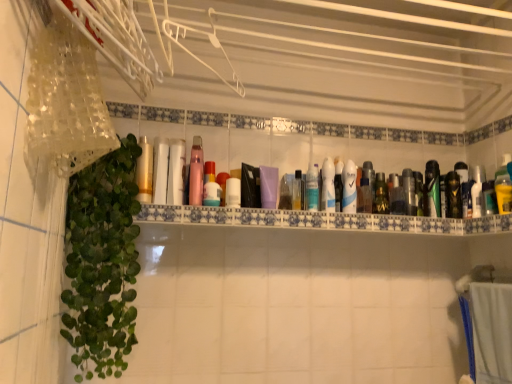
The height and width of the screenshot is (384, 512). Describe the element at coordinates (432, 189) in the screenshot. I see `green metallic mouthwash at upper right, the 16th mouthwash from the left` at that location.

I want to click on white glossy bottle at center, which is the 2th mouthwash from left to right, so tap(176, 172).

What are the coordinates of `metallic gold mouthwash at right, acting as the 17th mouthwash starting from the left` in the screenshot? It's located at (453, 195).

This screenshot has height=384, width=512. I want to click on white glossy mouthwash at center, which is the 10th mouthwash from left to right, so click(x=328, y=186).

Measure the distance between translucent plastic bottle at center, the 11th mouthwash when ordered from right to left, and camera.

The distance of translucent plastic bottle at center, the 11th mouthwash when ordered from right to left, from camera is 1.39 meters.

Measure the distance between point (x=414, y=189) and camera.

A distance of 4.95 feet exists between point (x=414, y=189) and camera.

You are a GUI agent. You are given a task and a screenshot of the screen. Output one action in this format:
    pyautogui.click(x=<x>, y=<y>)
    Task: Click on the green metallic mouthwash at upper right, the 3th mouthwash from the right
    The image size is (512, 384).
    Given the screenshot: What is the action you would take?
    pyautogui.click(x=432, y=189)

Based on the photo, is clear plastic bottle at center, the seventh mouthwash from the right, further to camera compared to white plastic hanger at upper center?

Yes.

From a real-world perspective, is clear plastic bottle at center, the seventh mouthwash from the right, positioned above or below white plastic hanger at upper center?

Clearly, from a real-world perspective, clear plastic bottle at center, the seventh mouthwash from the right, is below white plastic hanger at upper center.

Which is nearer, (x=362, y=198) or (x=234, y=75)?

The point (x=362, y=198) is more forward.

Is yellow matte bottle at right, which is the first mouthwash in right-to-left order, positioned with its back to matte pink bottle at center, the fourteenth mouthwash positioned from the right?

No, yellow matte bottle at right, which is the first mouthwash in right-to-left order,'s orientation is not away from matte pink bottle at center, the fourteenth mouthwash positioned from the right.

How much distance is there between yellow matte bottle at right, which appears as the eighteenth mouthwash when viewed from the left, and matte pink bottle at center, which is counted as the 5th mouthwash, starting from the left?

yellow matte bottle at right, which appears as the eighteenth mouthwash when viewed from the left, and matte pink bottle at center, which is counted as the 5th mouthwash, starting from the left, are 35.62 inches apart.

Which object is more forward, yellow matte bottle at right, which is the first mouthwash in right-to-left order, or matte pink bottle at center, the fourteenth mouthwash positioned from the right?

yellow matte bottle at right, which is the first mouthwash in right-to-left order.

Who is shorter, yellow matte bottle at right, which is the first mouthwash in right-to-left order, or matte pink bottle at center, the fourteenth mouthwash positioned from the right?

Standing shorter between the two is matte pink bottle at center, the fourteenth mouthwash positioned from the right.

Would you say white glossy bottle at center, which is the seventeenth mouthwash in right-to-left order, is outside metallic gold mouthwash at right, acting as the 17th mouthwash starting from the left?

white glossy bottle at center, which is the seventeenth mouthwash in right-to-left order, lies outside metallic gold mouthwash at right, acting as the 17th mouthwash starting from the left,'s area.

Between white glossy bottle at center, which is the seventeenth mouthwash in right-to-left order, and metallic gold mouthwash at right, acting as the second mouthwash starting from the right, which one appears on the left side from the viewer's perspective?

From the viewer's perspective, white glossy bottle at center, which is the seventeenth mouthwash in right-to-left order, appears more on the left side.

Is white glossy bottle at center, which is the 2th mouthwash from left to right, bigger than metallic gold mouthwash at right, acting as the second mouthwash starting from the right?

Indeed, white glossy bottle at center, which is the 2th mouthwash from left to right, has a larger size compared to metallic gold mouthwash at right, acting as the second mouthwash starting from the right.

Is white glossy bottle at center, which is the 2th mouthwash from left to right, oriented away from metallic gold mouthwash at right, acting as the second mouthwash starting from the right?

white glossy bottle at center, which is the 2th mouthwash from left to right, does not have its back to metallic gold mouthwash at right, acting as the second mouthwash starting from the right.

Between green glossy mouthwash at center right, placed as the thirteenth mouthwash when sorted from left to right, and metallic silver mouthwash at center-right, placed as the fourth mouthwash when sorted from right to left, which one appears on the right side from the viewer's perspective?

From the viewer's perspective, metallic silver mouthwash at center-right, placed as the fourth mouthwash when sorted from right to left, appears more on the right side.

Is green glossy mouthwash at center right, positioned as the 6th mouthwash in right-to-left order, positioned beyond the bounds of metallic silver mouthwash at center-right, which is counted as the 15th mouthwash, starting from the left?

That's correct, green glossy mouthwash at center right, positioned as the 6th mouthwash in right-to-left order, is outside of metallic silver mouthwash at center-right, which is counted as the 15th mouthwash, starting from the left.

From the image's perspective, is green glossy mouthwash at center right, placed as the thirteenth mouthwash when sorted from left to right, located above metallic silver mouthwash at center-right, placed as the fourth mouthwash when sorted from right to left?

Actually, green glossy mouthwash at center right, placed as the thirteenth mouthwash when sorted from left to right, appears below metallic silver mouthwash at center-right, placed as the fourth mouthwash when sorted from right to left, in the image.

Which of these two, translucent plastic bottles at center or white glossy bottle at center, which is the 2th mouthwash from left to right, is smaller?

white glossy bottle at center, which is the 2th mouthwash from left to right.

Based on the photo, which is correct: translucent plastic bottles at center is inside white glossy bottle at center, which is the seventeenth mouthwash in right-to-left order, or outside of it?

translucent plastic bottles at center is outside white glossy bottle at center, which is the seventeenth mouthwash in right-to-left order.

Based on the photo, how many degrees apart are the facing directions of translucent plastic bottles at center and white glossy bottle at center, which is the 2th mouthwash from left to right?

2.9 degrees separate the facing orientations of translucent plastic bottles at center and white glossy bottle at center, which is the 2th mouthwash from left to right.

Between translucent plastic bottles at center and white glossy bottle at center, which is the seventeenth mouthwash in right-to-left order, which one appears on the left side from the viewer's perspective?

From the viewer's perspective, white glossy bottle at center, which is the seventeenth mouthwash in right-to-left order, appears more on the left side.

From the image's perspective, does white plastic hanger at upper center appear higher than clear plastic bottle at center, the seventh mouthwash from the right?

Yes, from the image's perspective, white plastic hanger at upper center is over clear plastic bottle at center, the seventh mouthwash from the right.

Between white plastic hanger at upper center and clear plastic bottle at center, the seventh mouthwash from the right, which one has less height?

Standing shorter between the two is white plastic hanger at upper center.

Which object is positioned more to the right, white plastic hanger at upper center or clear plastic bottle at center, which is the 12th mouthwash in left-to-right order?

Positioned to the right is clear plastic bottle at center, which is the 12th mouthwash in left-to-right order.

Starting from the white plastic hanger at upper center, which mouthwash is the 8th one to the right? Please provide its 2D coordinates.

[(367, 186)]

Does white glossy mouthwash at center, the ninth mouthwash positioned from the right, come behind metallic gold mouthwash at right, acting as the 17th mouthwash starting from the left?

No, white glossy mouthwash at center, the ninth mouthwash positioned from the right, is in front of metallic gold mouthwash at right, acting as the 17th mouthwash starting from the left.

From a real-world perspective, between white glossy mouthwash at center, which is the 10th mouthwash from left to right, and metallic gold mouthwash at right, acting as the 17th mouthwash starting from the left, who is vertically lower?

metallic gold mouthwash at right, acting as the 17th mouthwash starting from the left, from a real-world perspective.

In the scene shown: In terms of size, does white glossy mouthwash at center, which is the 10th mouthwash from left to right, appear bigger or smaller than metallic gold mouthwash at right, acting as the second mouthwash starting from the right?

Clearly, white glossy mouthwash at center, which is the 10th mouthwash from left to right, is larger in size than metallic gold mouthwash at right, acting as the second mouthwash starting from the right.

Considering the sizes of objects white glossy mouthwash at center, the ninth mouthwash positioned from the right, and metallic gold mouthwash at right, acting as the 17th mouthwash starting from the left, in the image provided, who is shorter, white glossy mouthwash at center, the ninth mouthwash positioned from the right, or metallic gold mouthwash at right, acting as the 17th mouthwash starting from the left,?

Standing shorter between the two is metallic gold mouthwash at right, acting as the 17th mouthwash starting from the left.

Find the location of a particular element. hanger above the clear plastic bottle at center, which is the 12th mouthwash in left-to-right order (from the image's perspective) is located at coordinates (209, 41).

Locate an element on the screen. mouthwash that is the 15th one below the yellow matte bottle at right, which appears as the eighteenth mouthwash when viewed from the left (from a real-world perspective) is located at coordinates (222, 185).

Based on their spatial positions, is matte purple bottle at center, which ranks as the 12th mouthwash in right-to-left order, or translucent plastic bottle at center, the fourth mouthwash viewed from the left, closer to translucent plastic bottles at center?

Among the two, matte purple bottle at center, which ranks as the 12th mouthwash in right-to-left order, is located nearer to translucent plastic bottles at center.

Looking at the image, which one is located closer to green glossy mouthwash at center right, placed as the thirteenth mouthwash when sorted from left to right, white glossy mouthwash at center, placed as the eleventh mouthwash when sorted from left to right, or blue glossy mouthwash at center, positioned as the 9th mouthwash in left-to-right order?

The object closer to green glossy mouthwash at center right, placed as the thirteenth mouthwash when sorted from left to right, is white glossy mouthwash at center, placed as the eleventh mouthwash when sorted from left to right.

Estimate the real-world distances between objects in this image. Which object is closer to green metallic mouthwash at upper right, the 3th mouthwash from the right, white glossy mouthwash at center, which is the 10th mouthwash from left to right, or matte purple bottle at center, which ranks as the 12th mouthwash in right-to-left order?

white glossy mouthwash at center, which is the 10th mouthwash from left to right, is positioned closer to the anchor green metallic mouthwash at upper right, the 3th mouthwash from the right.

Considering their positions, is green metallic mouthwash at upper right, the 16th mouthwash from the left, positioned further to white plastic hanger at upper center than green leafy plant at left?

green metallic mouthwash at upper right, the 16th mouthwash from the left.

In the scene shown: Looking at the image, which one is located further to metallic silver mouthwash at center-right, placed as the fourth mouthwash when sorted from right to left, gold metallic tube at center, marked as the 18th mouthwash in a right-to-left arrangement, or matte purple bottle at center, the 7th mouthwash when ordered from left to right?

gold metallic tube at center, marked as the 18th mouthwash in a right-to-left arrangement, is positioned further to the anchor metallic silver mouthwash at center-right, placed as the fourth mouthwash when sorted from right to left.

Considering their positions, is yellow matte bottle at right, which is the first mouthwash in right-to-left order, positioned closer to blue fabric bath towel at lower right than matte purple bottle at center, the 7th mouthwash when ordered from left to right?

yellow matte bottle at right, which is the first mouthwash in right-to-left order, is positioned closer to the anchor blue fabric bath towel at lower right.

Which object lies nearer to the anchor point green leafy plant at left, metallic silver mouthwash at center-right, placed as the fourth mouthwash when sorted from right to left, or white plastic hanger at upper center?

The object closer to green leafy plant at left is white plastic hanger at upper center.

When comparing their distances from white glossy mouthwash at center, which is the eighth mouthwash in right-to-left order, does matte purple bottle at center, the 7th mouthwash when ordered from left to right, or white glossy bottle at center, arranged as the 13th mouthwash when viewed from the right, seem further?

white glossy bottle at center, arranged as the 13th mouthwash when viewed from the right, is positioned further to the anchor white glossy mouthwash at center, which is the eighth mouthwash in right-to-left order.

Find the location of a particular element. shelve situated between matte purple bottle at center, the 7th mouthwash when ordered from left to right, and metallic gold mouthwash at right, acting as the 17th mouthwash starting from the left, from left to right is located at coordinates (322, 220).

I want to click on shelve situated between white glossy bottle at center, acting as the sixth mouthwash starting from the left, and blue glossy mouthwash at center, which appears as the 10th mouthwash when viewed from the right, from left to right, so [x=322, y=220].

Find the location of a particular element. shelve between white glossy bottle at center, arranged as the 13th mouthwash when viewed from the right, and yellow matte bottle at right, which appears as the eighteenth mouthwash when viewed from the left, from left to right is located at coordinates (322, 220).

What are the coordinates of `shelve located between pink glossy mouthwash at center, which is the sixteenth mouthwash from right to left, and metallic gold mouthwash at right, acting as the 17th mouthwash starting from the left, in the left-right direction` in the screenshot? It's located at (322, 220).